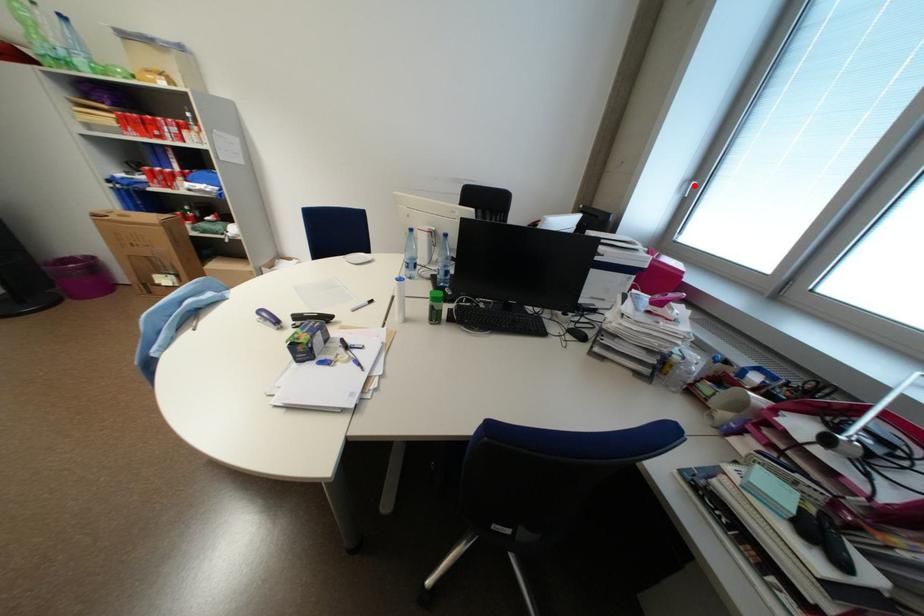
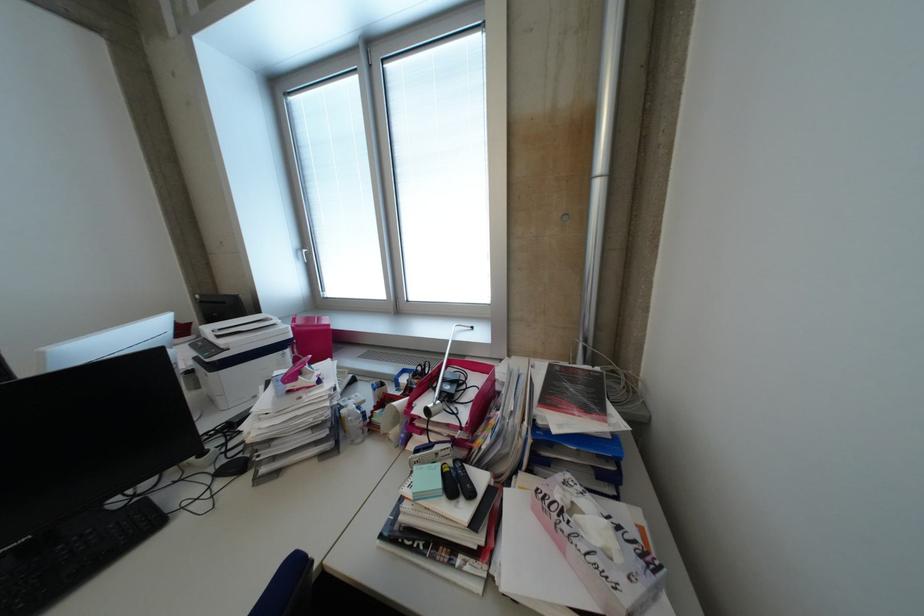
The point at the highlighted location is marked in the first image. Where is the corresponding point in the second image?

(309, 254)